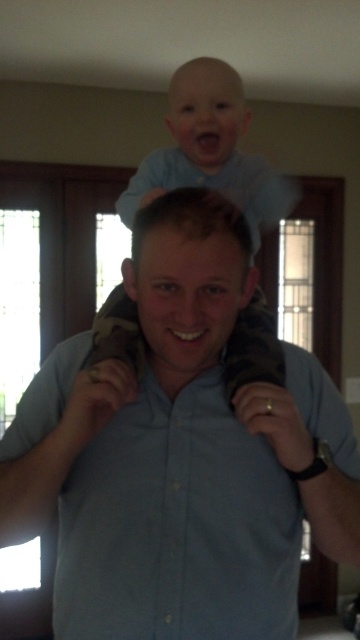
Question: Is blue cotton shirt at center thinner than light blue shirt at upper center?

Choices:
 (A) yes
 (B) no

Answer: (B)

Question: Which object is closer to the camera taking this photo?

Choices:
 (A) light blue fabric at upper center
 (B) light blue shirt at upper center
 (C) blue cotton shirt at center

Answer: (C)

Question: Which point is farther to the camera?

Choices:
 (A) (137, 436)
 (B) (222, 157)
 (C) (132, 204)

Answer: (C)

Question: In this image, where is light blue fabric at upper center located relative to light blue shirt at upper center?

Choices:
 (A) right
 (B) left

Answer: (B)

Question: Where is light blue fabric at upper center located in relation to light blue shirt at upper center in the image?

Choices:
 (A) below
 (B) above

Answer: (A)

Question: Which point appears closest to the camera in this image?

Choices:
 (A) (111, 442)
 (B) (97, 340)
 (C) (281, 204)

Answer: (A)